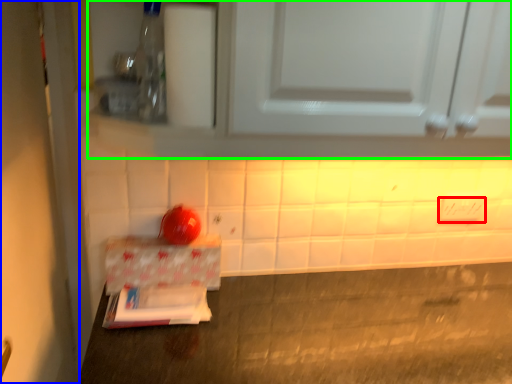
Question: Considering the real-world distances, which object is closest to electric outlet (highlighted by a red box)? door (highlighted by a blue box) or cabinetry (highlighted by a green box).

Choices:
 (A) door
 (B) cabinetry

Answer: (B)